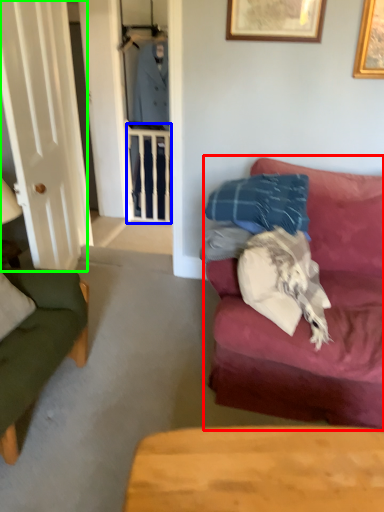
Question: Which object is the closest to the studio couch (highlighted by a red box)? Choose among these: balustrade (highlighted by a blue box) or glass door (highlighted by a green box).

Choices:
 (A) balustrade
 (B) glass door

Answer: (B)